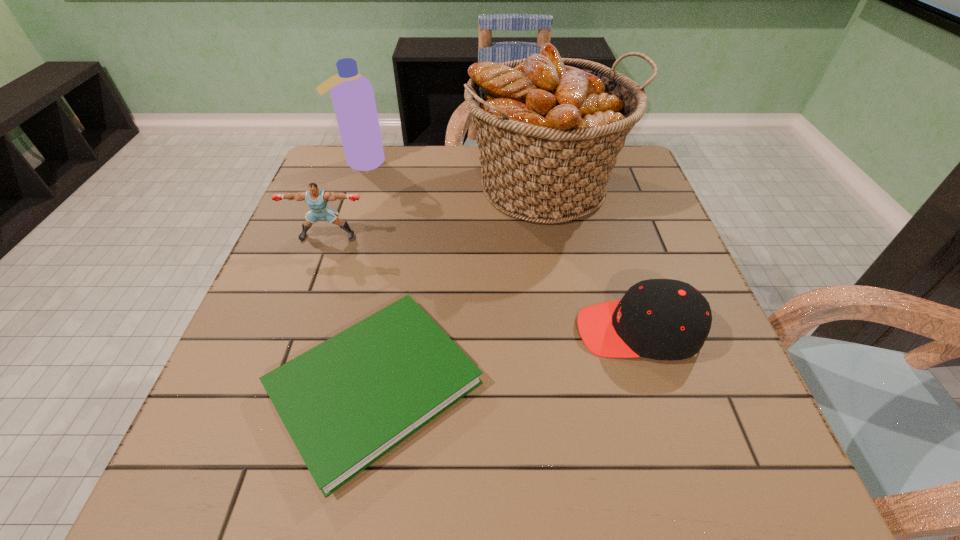
Where is `vacant space that satisfies the following two spatial constraints: 1. on the front-facing side of the puncher; 2. on the left side of the paperback book`? Image resolution: width=960 pixels, height=540 pixels. vacant space that satisfies the following two spatial constraints: 1. on the front-facing side of the puncher; 2. on the left side of the paperback book is located at coordinates (274, 384).

Locate an element on the screen. free space that satisfies the following two spatial constraints: 1. on the front-facing side of the shortest object; 2. on the left side of the puncher is located at coordinates (274, 384).